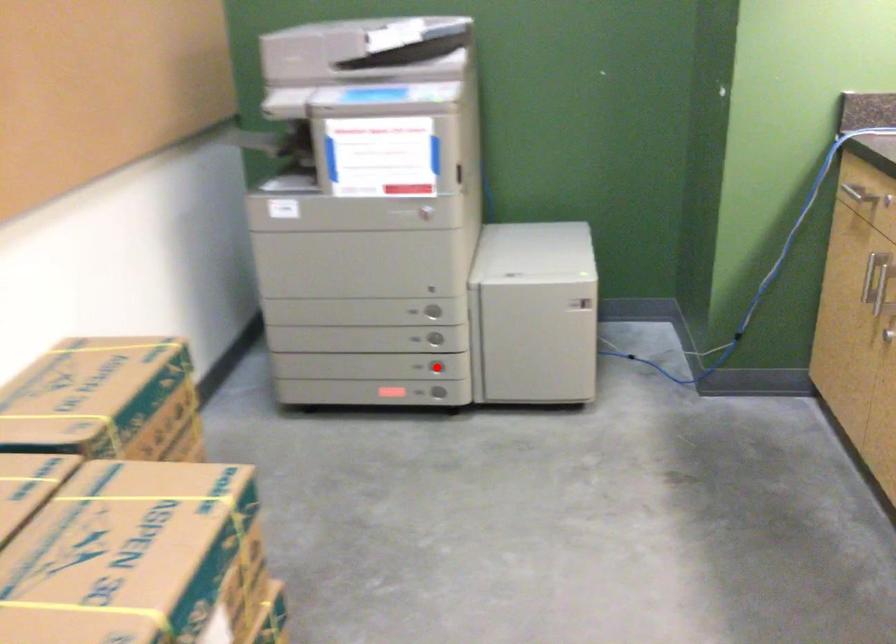
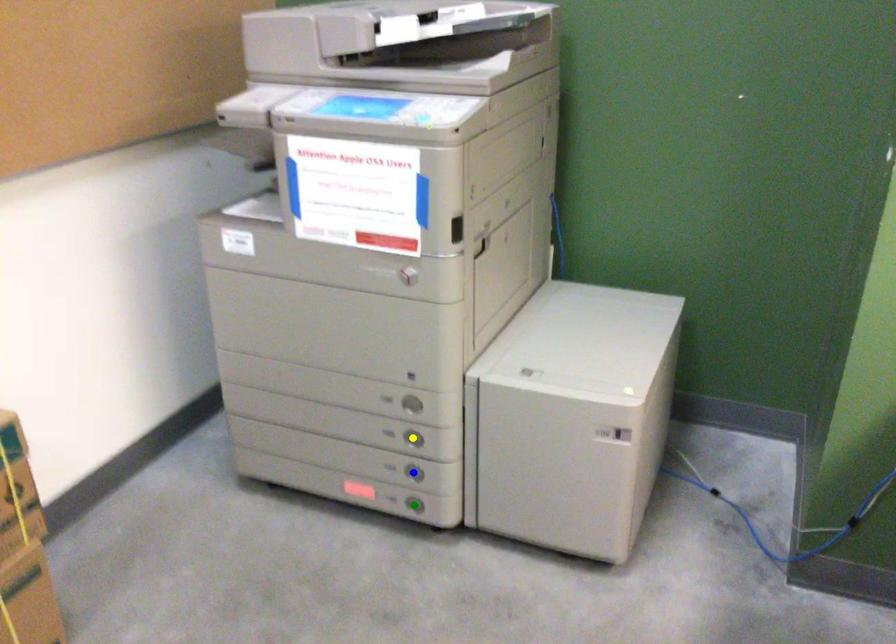
Question: I am providing you with two images of the same scene from different viewpoints. A red point is marked on the first image. You are given multiple points on the second image. Which point in image 2 is actually the same real-world point as the red point in image 1?

Choices:
 (A) green point
 (B) blue point
 (C) yellow point

Answer: (B)